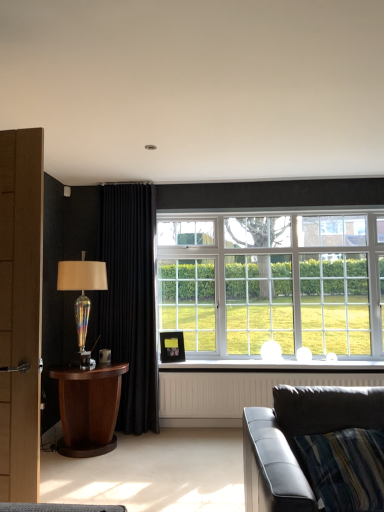
Question: From a real-world perspective, is white glass window at center over white textured radiator at lower center?

Choices:
 (A) yes
 (B) no

Answer: (A)

Question: Can we say white glass window at center lies outside white textured radiator at lower center?

Choices:
 (A) yes
 (B) no

Answer: (A)

Question: Can you see white glass window at center touching white textured radiator at lower center?

Choices:
 (A) no
 (B) yes

Answer: (A)

Question: Can you confirm if white glass window at center is smaller than white textured radiator at lower center?

Choices:
 (A) yes
 (B) no

Answer: (B)

Question: From the image's perspective, is white glass window at center above white textured radiator at lower center?

Choices:
 (A) no
 (B) yes

Answer: (B)

Question: Is white glass window at center facing away from white textured radiator at lower center?

Choices:
 (A) yes
 (B) no

Answer: (B)

Question: Can you confirm if wooden table at left is taller than white textured radiator at lower center?

Choices:
 (A) no
 (B) yes

Answer: (B)

Question: From a real-world perspective, is wooden table at left under white textured radiator at lower center?

Choices:
 (A) yes
 (B) no

Answer: (B)

Question: Considering the relative sizes of wooden table at left and white textured radiator at lower center in the image provided, is wooden table at left shorter than white textured radiator at lower center?

Choices:
 (A) yes
 (B) no

Answer: (B)

Question: Is the position of wooden table at left less distant than that of white textured radiator at lower center?

Choices:
 (A) no
 (B) yes

Answer: (B)

Question: From the image's perspective, is wooden table at left below white textured radiator at lower center?

Choices:
 (A) no
 (B) yes

Answer: (A)

Question: Does wooden table at left appear on the right side of white textured radiator at lower center?

Choices:
 (A) no
 (B) yes

Answer: (A)

Question: From a real-world perspective, is leather couch at lower right below wooden table at left?

Choices:
 (A) yes
 (B) no

Answer: (B)